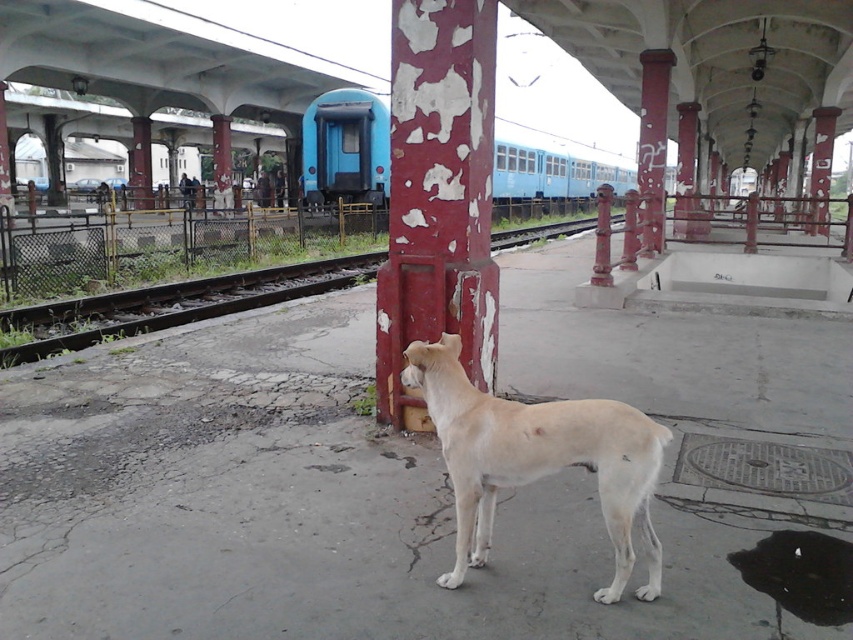
Question: Which of the following is the closest to the observer?

Choices:
 (A) (257, 292)
 (B) (349, 189)
 (C) (577, 435)
 (D) (488, 8)

Answer: (C)

Question: Which point is farther from the camera taking this photo?

Choices:
 (A) (334, 170)
 (B) (598, 397)
 (C) (390, 154)

Answer: (A)

Question: Does peeling paint column at center have a smaller size compared to fur white dog at center?

Choices:
 (A) yes
 (B) no

Answer: (B)

Question: Based on their relative distances, which object is farther from the rusty metal pillar at center?

Choices:
 (A) brown gravel train track at lower left
 (B) blue matte train at center
 (C) fur white dog at center

Answer: (B)

Question: Can you confirm if peeling paint column at center is positioned below blue matte train at center?

Choices:
 (A) yes
 (B) no

Answer: (A)

Question: Where is blue matte train at center located in relation to rusty metal pillar at center in the image?

Choices:
 (A) left
 (B) right

Answer: (A)